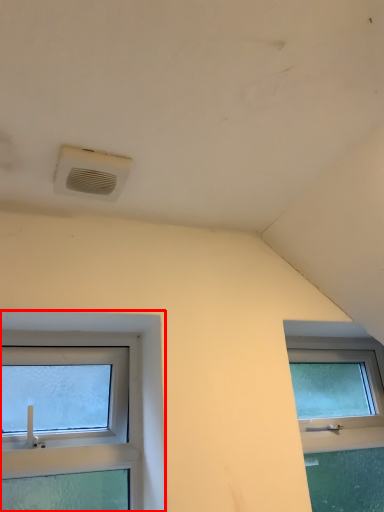
Question: From the image, what is the correct spatial relationship of window (annotated by the red box) in relation to air conditioning?

Choices:
 (A) left
 (B) right

Answer: (A)